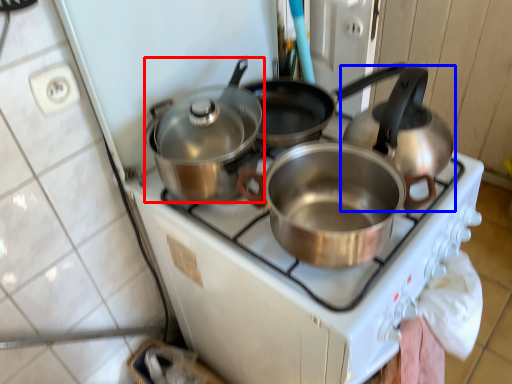
Question: Which point is closer to the camera, kitchen appliance (highlighted by a red box) or kettle (highlighted by a blue box)?

Choices:
 (A) kitchen appliance
 (B) kettle

Answer: (B)